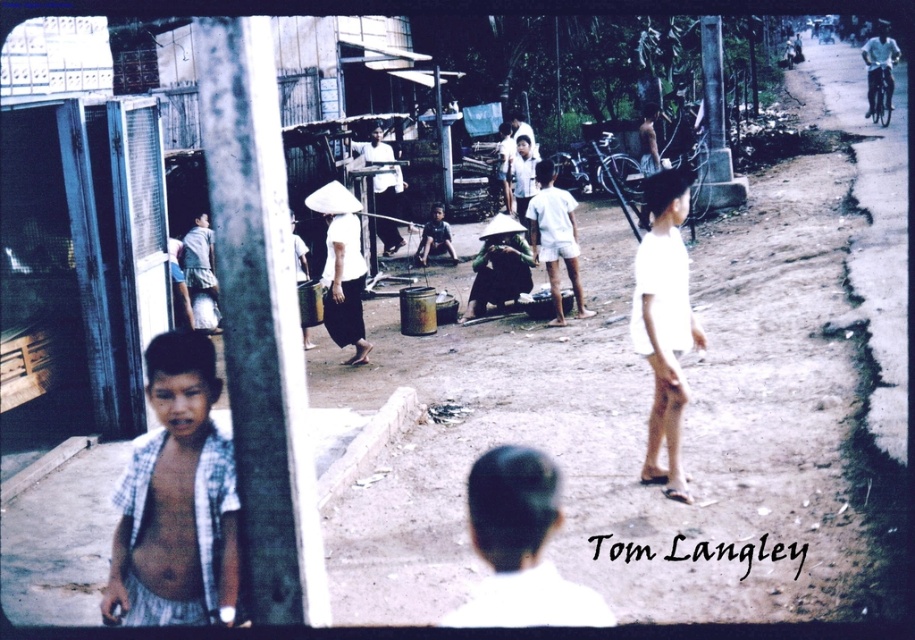
How far apart are white cotton shirt at center and matte black hat at center?

24.26 inches

From the picture: Is white cotton shirt at center shorter than matte black hat at center?

No, white cotton shirt at center is not shorter than matte black hat at center.

The width and height of the screenshot is (915, 640). Find the location of `white cotton shirt at center`. white cotton shirt at center is located at coordinates (555, 237).

Locate an element on the screen. white cotton shirt at center is located at coordinates (555, 237).

The height and width of the screenshot is (640, 915). In order to click on white matte shirt at center in this screenshot , I will do `click(520, 547)`.

Is white matte shirt at center bigger than white matte conical hat at center?

Incorrect, white matte shirt at center is not larger than white matte conical hat at center.

Does point (504, 532) come closer to viewer compared to point (338, 326)?

Yes, point (504, 532) is in front of point (338, 326).

I want to click on white matte shirt at center, so click(x=520, y=547).

Who is more distant from viewer, [197,332] or [674,404]?

The point [197,332] is behind.

Based on the photo, who is taller, checkered fabric shirt at left or white matte shorts at right?

Standing taller between the two is white matte shorts at right.

Image resolution: width=915 pixels, height=640 pixels. What do you see at coordinates (176, 500) in the screenshot?
I see `checkered fabric shirt at left` at bounding box center [176, 500].

At what (x,y) coordinates should I click in order to perform the action: click on checkered fabric shirt at left. Please return your answer as a coordinate pair (x, y). The image size is (915, 640). Looking at the image, I should click on (176, 500).